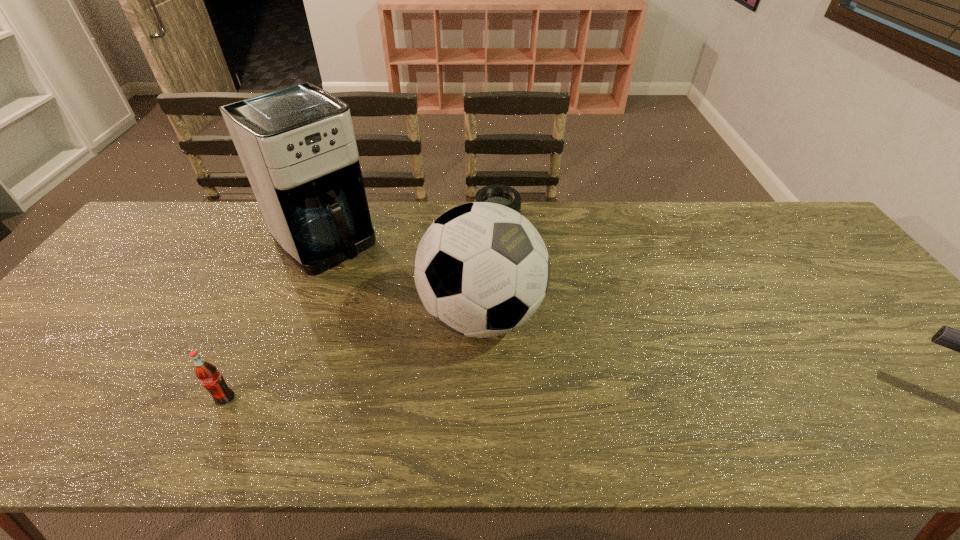
This screenshot has width=960, height=540. I want to click on soda bottle, so click(x=207, y=373).

I want to click on telephoto lens, so click(504, 195).

The height and width of the screenshot is (540, 960). In order to click on soccer ball in this screenshot , I will do `click(481, 269)`.

You are a GUI agent. You are given a task and a screenshot of the screen. Output one action in this format:
    pyautogui.click(x=<x>, y=<y>)
    Task: Click on the tallest object
    The height and width of the screenshot is (540, 960).
    Given the screenshot: What is the action you would take?
    pyautogui.click(x=297, y=145)

Locate an element on the screen. The height and width of the screenshot is (540, 960). free point located on the side of the telephoto lens with brand markings and control switches is located at coordinates (501, 268).

You are a GUI agent. You are given a task and a screenshot of the screen. Output one action in this format:
    pyautogui.click(x=<x>, y=<y>)
    Task: Click on the vacant space located on the side of the telephoto lens with brand markings and control switches
    
    Given the screenshot: What is the action you would take?
    pyautogui.click(x=503, y=290)

Locate an element on the screen. This screenshot has height=540, width=960. vacant region located 0.260m on the side of the telephoto lens with brand markings and control switches is located at coordinates (504, 298).

Find the location of a particular element. Image resolution: width=960 pixels, height=540 pixels. vacant space positioned on the main logo of the second tallest object is located at coordinates (562, 362).

The width and height of the screenshot is (960, 540). In order to click on free space located on the main logo of the second tallest object in this screenshot , I will do coord(577,370).

The height and width of the screenshot is (540, 960). What are the coordinates of `vacant space located on the main logo of the second tallest object` in the screenshot? It's located at (612, 392).